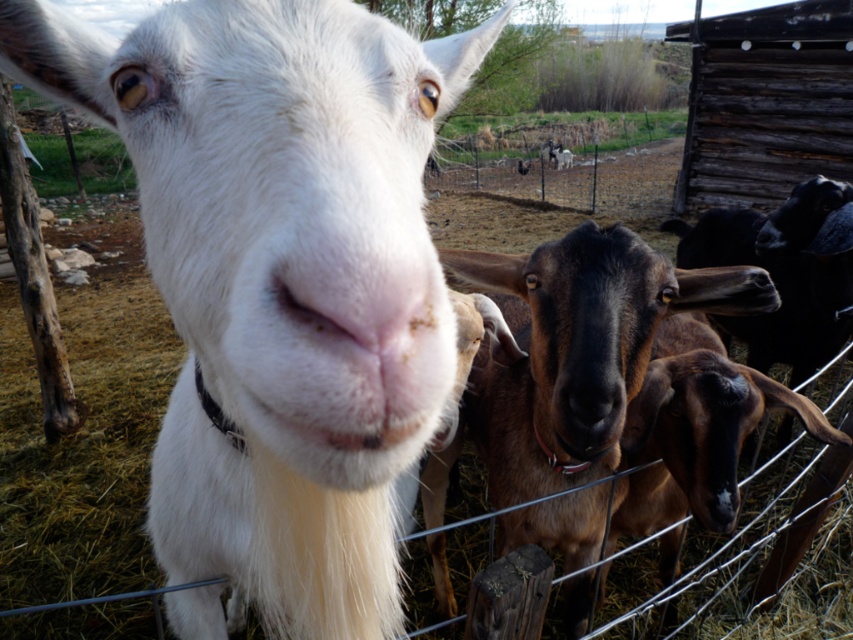
You are a farmer checking the size of your goats. You have a 1.2 meter wide feeding trough. Can both the white woolen goat at center and the brown furry goat at center fit side by side in the trough?

The white woolen goat at center is wider than the brown furry goat at center. Since the trough is 1.2 meters wide, it depends on their combined widths. However, the exact widths aren

You are a farmer who wants to separate two goats using a divider. The divider can only fit between them if there is at least 20 inches of space. Based on the scene, can you place the divider between the white woolen goat at center and the brown furry goat at center?

The white woolen goat at center and brown furry goat at center are 19.31 inches apart, which is less than the required 20 inches. Therefore, the divider cannot be placed between them.